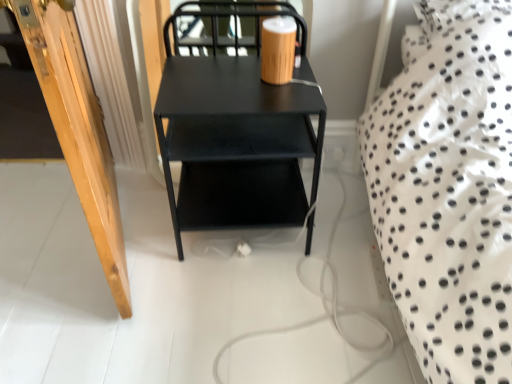
Image resolution: width=512 pixels, height=384 pixels. I want to click on free space that is to the left of wooden door at left, so pyautogui.click(x=42, y=218).